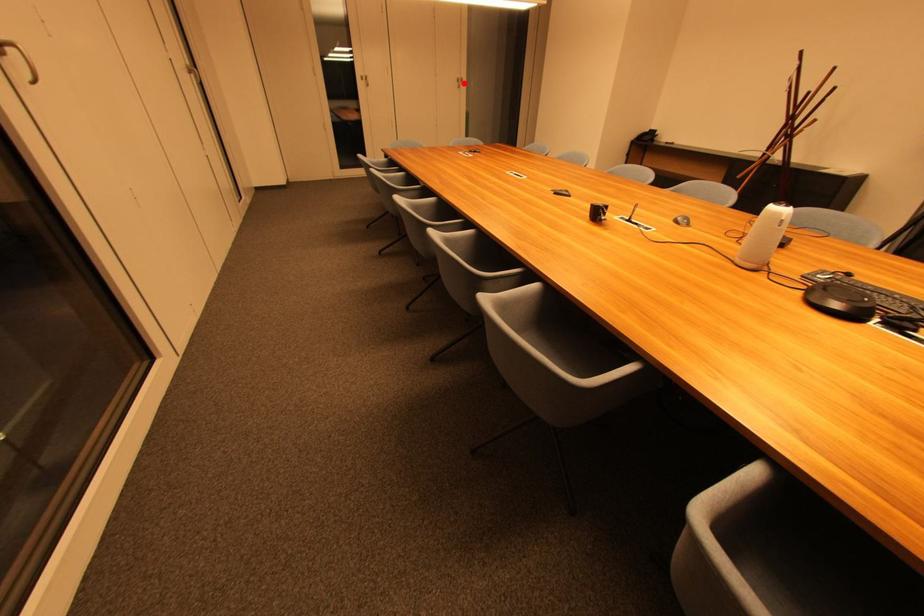
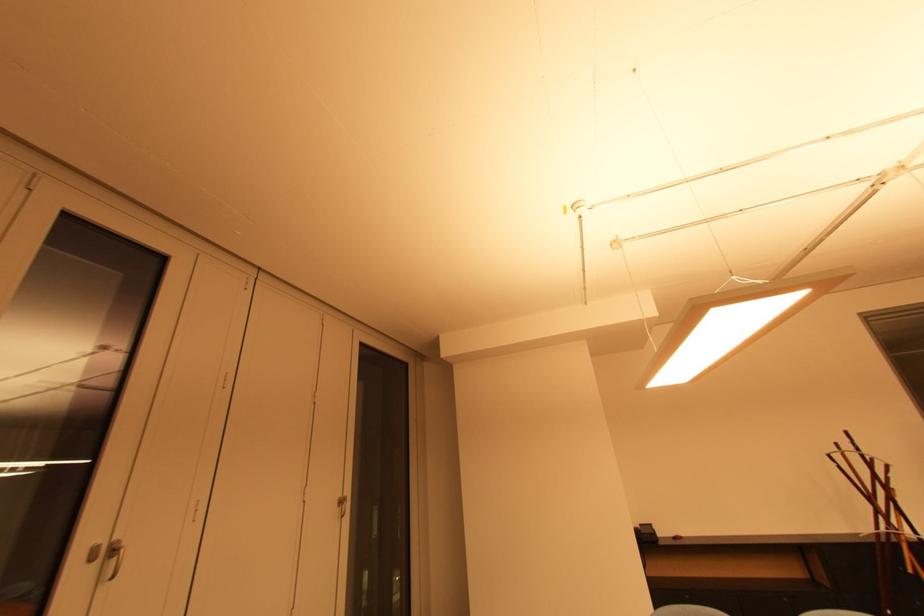
Question: I am providing you with two images of the same scene from different viewpoints. Given a red point in image1, look at the same physical point in image2. Is it:

Choices:
 (A) Closer to the viewpoint
 (B) Farther from the viewpoint

Answer: (B)